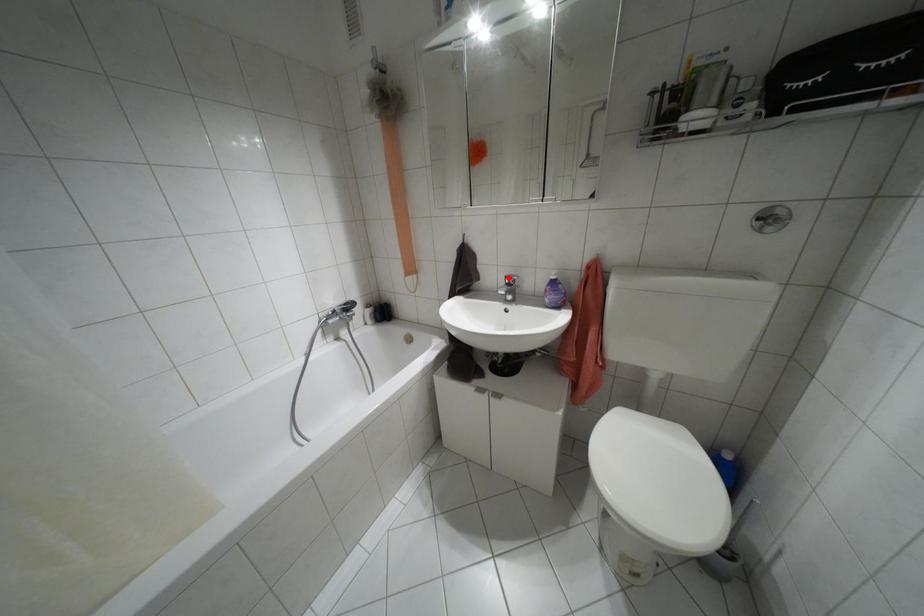
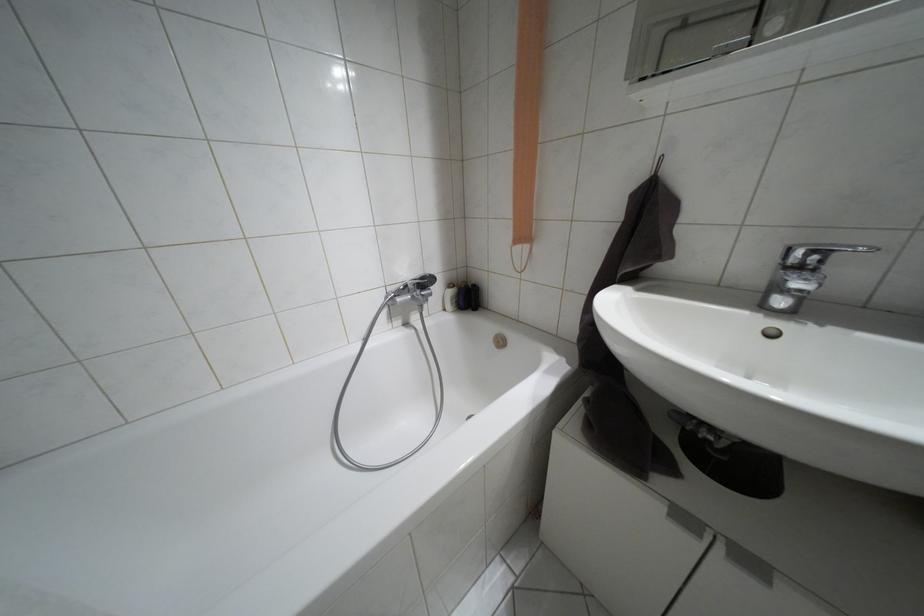
Find the pixel in the second image that matches the highlighted location in the first image.

(810, 253)